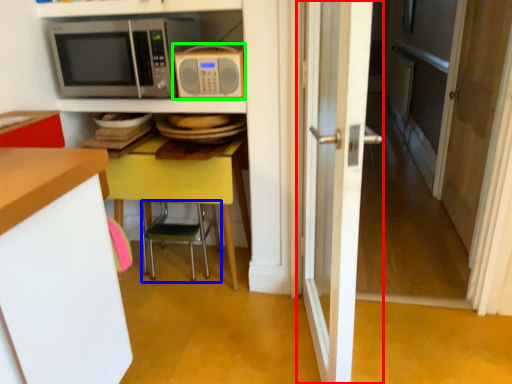
Question: Which is farther away from door (highlighted by a red box)? chair (highlighted by a blue box) or microwave oven (highlighted by a green box)?

Choices:
 (A) chair
 (B) microwave oven

Answer: (A)